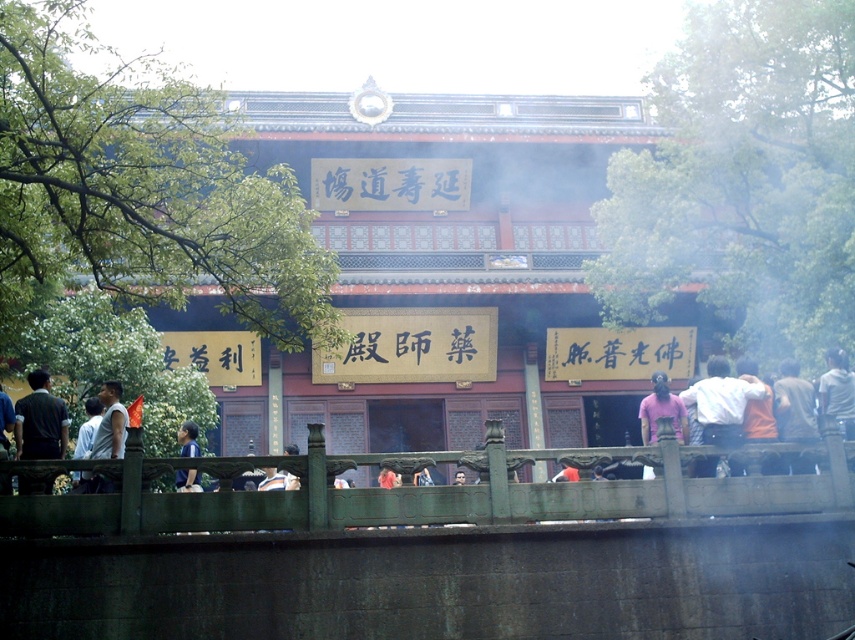
Question: Does white shirt at left appear over blue shirt at lower left?

Choices:
 (A) yes
 (B) no

Answer: (A)

Question: Which point is farther to the camera?

Choices:
 (A) (490, 244)
 (B) (299, 528)
 (C) (91, 481)
 (D) (653, 440)

Answer: (A)

Question: Observing the image, what is the correct spatial positioning of dark brown shirt at right in reference to blue shirt at lower left?

Choices:
 (A) right
 (B) left

Answer: (A)

Question: Where is pink fabric at right located in relation to dark gray shirt at lower left in the image?

Choices:
 (A) above
 (B) below

Answer: (A)

Question: Among these points, which one is nearest to the camera?

Choices:
 (A) (662, 380)
 (B) (198, 432)

Answer: (A)

Question: Which object is closer to the camera taking this photo?

Choices:
 (A) blue shirt at lower left
 (B) dark gray shirt at lower left
 (C) reddish-brown wooden temple at center
 (D) white cotton shirt at right

Answer: (B)